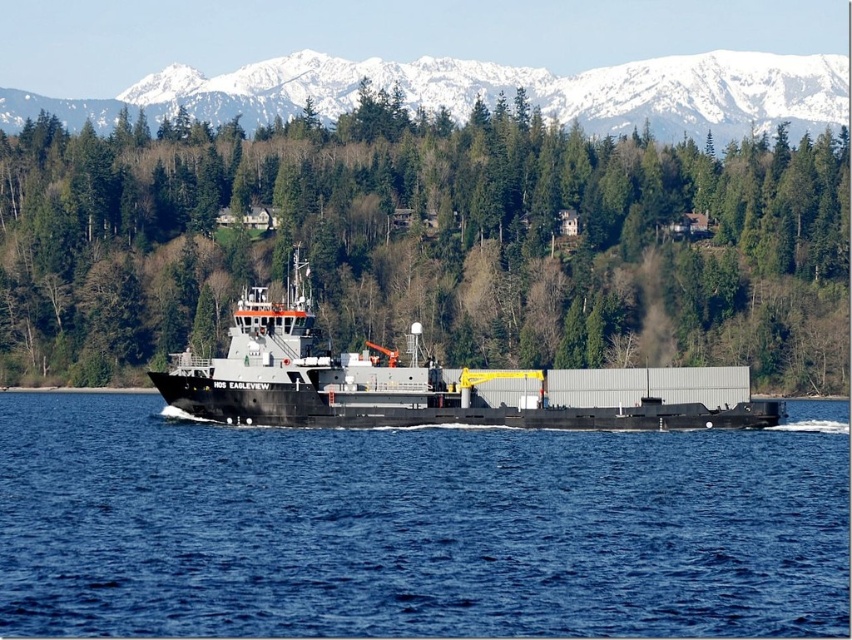
Between green matte tree at center and snowy white mountain at upper center, which one is positioned lower?

Positioned lower is green matte tree at center.

Does green matte tree at center have a lesser height compared to snowy white mountain at upper center?

No, green matte tree at center is not shorter than snowy white mountain at upper center.

Where is `green matte tree at center`? green matte tree at center is located at coordinates (426, 241).

Who is shorter, blue water at center or black matte barge at center?

blue water at center

Identify the location of blue water at center. (413, 528).

Who is more distant from viewer, (804, 632) or (643, 401)?

Positioned behind is point (643, 401).

The width and height of the screenshot is (852, 640). Identify the location of blue water at center. (413, 528).

Who is more forward, [377,365] or [738,77]?

Point [377,365] is more forward.

Is black matte barge at center closer to the viewer compared to snowy white mountain at upper center?

Yes.

Identify the location of black matte barge at center. The width and height of the screenshot is (852, 640). (432, 384).

Locate an element on the screen. black matte barge at center is located at coordinates (432, 384).